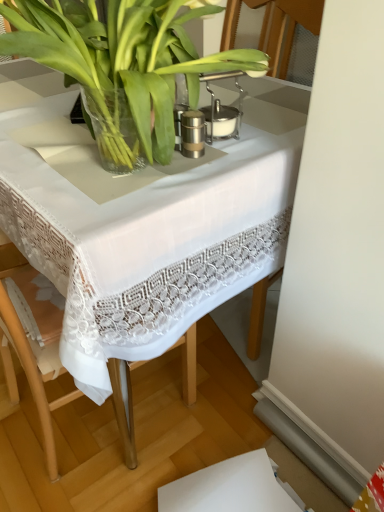
Image resolution: width=384 pixels, height=512 pixels. What do you see at coordinates (123, 55) in the screenshot?
I see `green leafy plant at center` at bounding box center [123, 55].

At what (x,y) coordinates should I click in order to perform the action: click on green leafy plant at center. Please return your answer as a coordinate pair (x, y). Looking at the image, I should click on pyautogui.click(x=123, y=55).

This screenshot has width=384, height=512. Describe the element at coordinates (148, 230) in the screenshot. I see `white lace tablecloth at center` at that location.

The width and height of the screenshot is (384, 512). I want to click on white lace tablecloth at center, so click(148, 230).

Find the location of a particular element. This screenshot has width=384, height=512. green leafy plant at center is located at coordinates (123, 55).

Is green leafy plant at center to the left of white lace tablecloth at center from the viewer's perspective?

In fact, green leafy plant at center is to the right of white lace tablecloth at center.

Is green leafy plant at center closer to the viewer compared to white lace tablecloth at center?

Yes, green leafy plant at center is in front of white lace tablecloth at center.

Considering the positions of point (152, 143) and point (192, 222), is point (152, 143) closer or farther from the camera than point (192, 222)?

Point (152, 143) is positioned closer to the camera compared to point (192, 222).

From the image's perspective, is green leafy plant at center beneath white lace tablecloth at center?

Actually, green leafy plant at center appears above white lace tablecloth at center in the image.

From a real-world perspective, is green leafy plant at center positioned above or below white lace tablecloth at center?

From a real-world perspective, green leafy plant at center is physically above white lace tablecloth at center.

Can you confirm if green leafy plant at center is thinner than white lace tablecloth at center?

Yes, green leafy plant at center is thinner than white lace tablecloth at center.

Consider the image. In terms of height, does green leafy plant at center look taller or shorter compared to white lace tablecloth at center?

Considering their sizes, green leafy plant at center has less height than white lace tablecloth at center.

Who is bigger, green leafy plant at center or white lace tablecloth at center?

white lace tablecloth at center is bigger.

Is green leafy plant at center outside of white lace tablecloth at center?

That's correct, green leafy plant at center is outside of white lace tablecloth at center.

Would you say green leafy plant at center is a long distance from white lace tablecloth at center?

They are positioned close to each other.

From the picture: Does green leafy plant at center turn towards white lace tablecloth at center?

No.

What's the angular difference between green leafy plant at center and white lace tablecloth at center's facing directions?

The angle between the facing direction of green leafy plant at center and the facing direction of white lace tablecloth at center is 0.274 degrees.

Locate an element on the screen. This screenshot has height=512, width=384. houseplant lying in front of the white lace tablecloth at center is located at coordinates pyautogui.click(x=123, y=55).

Can you confirm if white lace tablecloth at center is positioned to the left of green leafy plant at center?

Indeed, white lace tablecloth at center is positioned on the left side of green leafy plant at center.

Considering the positions of objects white lace tablecloth at center and green leafy plant at center in the image provided, who is in front, white lace tablecloth at center or green leafy plant at center?

green leafy plant at center is more forward.

Considering the points (72, 172) and (219, 11), which point is in front, point (72, 172) or point (219, 11)?

The point (72, 172) is closer.

From the image's perspective, is white lace tablecloth at center beneath green leafy plant at center?

Correct, white lace tablecloth at center appears lower than green leafy plant at center in the image.

From a real-world perspective, does white lace tablecloth at center stand above green leafy plant at center?

No, from a real-world perspective, white lace tablecloth at center is not above green leafy plant at center.

Does white lace tablecloth at center have a greater width compared to green leafy plant at center?

Correct, the width of white lace tablecloth at center exceeds that of green leafy plant at center.

Looking at this image, does white lace tablecloth at center have a greater height compared to green leafy plant at center?

Correct, white lace tablecloth at center is much taller as green leafy plant at center.

Considering the sizes of objects white lace tablecloth at center and green leafy plant at center in the image provided, who is bigger, white lace tablecloth at center or green leafy plant at center?

white lace tablecloth at center.

Is white lace tablecloth at center completely or partially outside of green leafy plant at center?

Yes.

Is white lace tablecloth at center not near green leafy plant at center?

white lace tablecloth at center is near green leafy plant at center, not far away.

Is white lace tablecloth at center oriented towards green leafy plant at center?

No, white lace tablecloth at center does not turn towards green leafy plant at center.

Can you tell me how much white lace tablecloth at center and green leafy plant at center differ in facing direction?

The angular difference between white lace tablecloth at center and green leafy plant at center is 0.274 degrees.

At what (x,y) coordinates should I click in order to perform the action: click on houseplant positioned vertically above the white lace tablecloth at center (from a real-world perspective). Please return your answer as a coordinate pair (x, y). Image resolution: width=384 pixels, height=512 pixels. Looking at the image, I should click on (123, 55).

Identify the location of houseplant in front of the white lace tablecloth at center. This screenshot has width=384, height=512. (123, 55).

Locate an element on the screen. houseplant that appears on the right of white lace tablecloth at center is located at coordinates (123, 55).